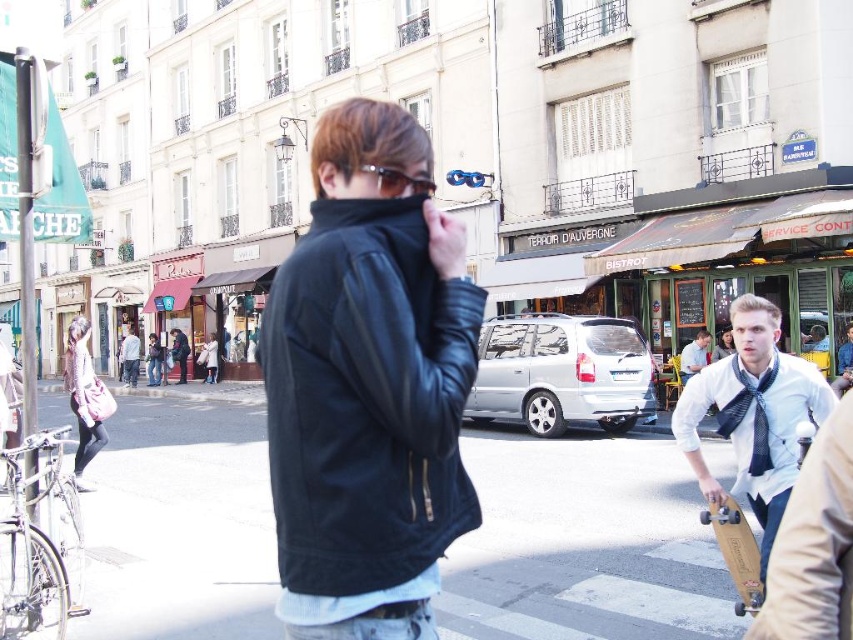
Question: Which point is farther to the camera?

Choices:
 (A) dark blue leather jacket at center
 (B) light blue denim jacket at center
 (C) white shirt with tie at center

Answer: (A)

Question: Does silver metallic van at center appear on the right side of light blue shirt at center?

Choices:
 (A) no
 (B) yes

Answer: (A)

Question: Which of the following is the farthest from the observer?

Choices:
 (A) pos(134,360)
 (B) pos(186,349)
 (C) pos(479,368)
 (D) pos(808,372)

Answer: (A)

Question: Among these points, which one is farthest from the camera?

Choices:
 (A) (173, 358)
 (B) (125, 348)

Answer: (B)

Question: Can you confirm if silver metallic van at center is bigger than light blue shirt at center?

Choices:
 (A) no
 (B) yes

Answer: (B)

Question: Is black leather jacket at center above white shirt with tie at center?

Choices:
 (A) no
 (B) yes

Answer: (A)